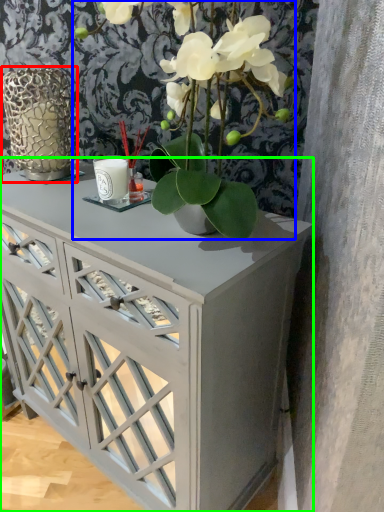
Question: Which object is positioned farthest from glass vase (highlighted by a red box)? Select from houseplant (highlighted by a blue box) and table (highlighted by a green box).

Choices:
 (A) houseplant
 (B) table

Answer: (B)